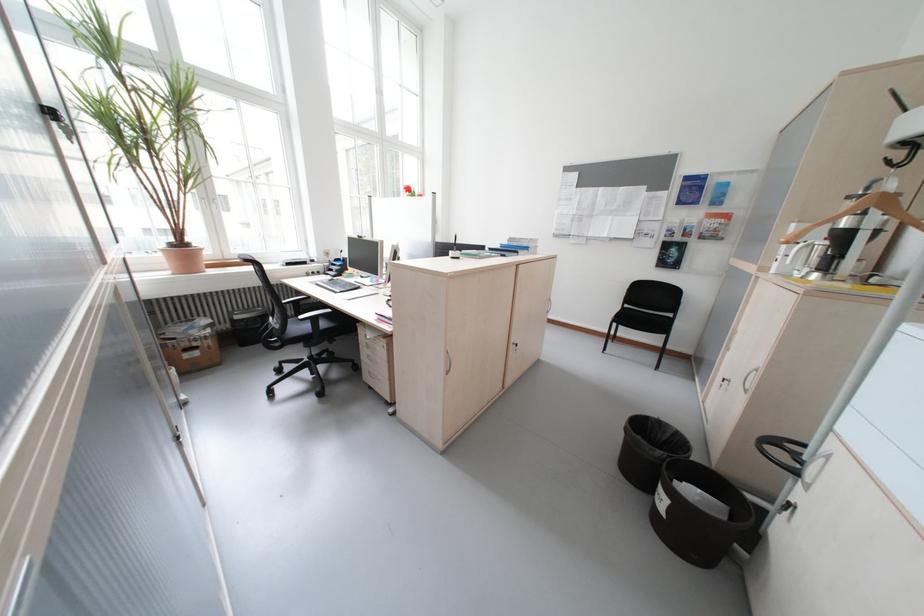
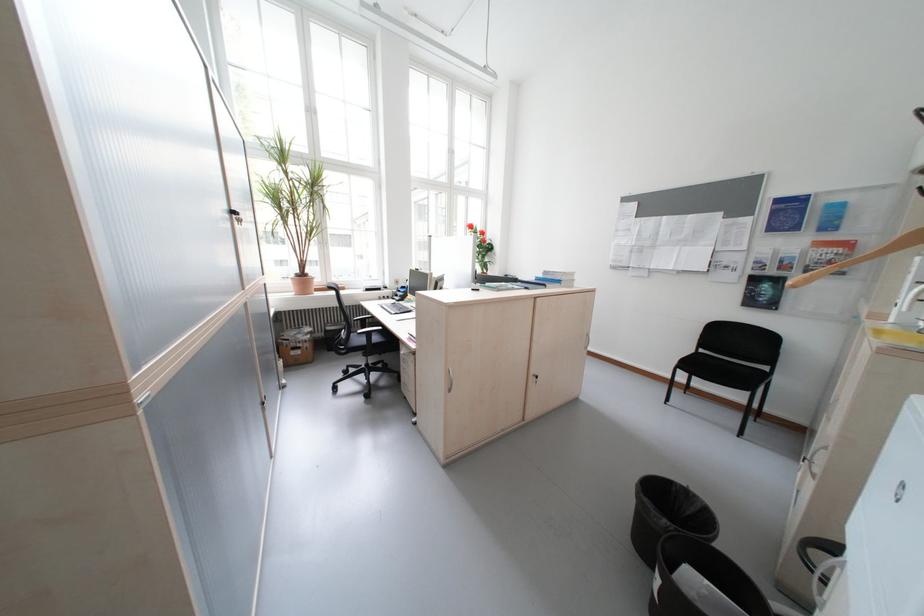
Where in the second image is the point corresponding to the point at 672,328 from the first image?

(758, 382)